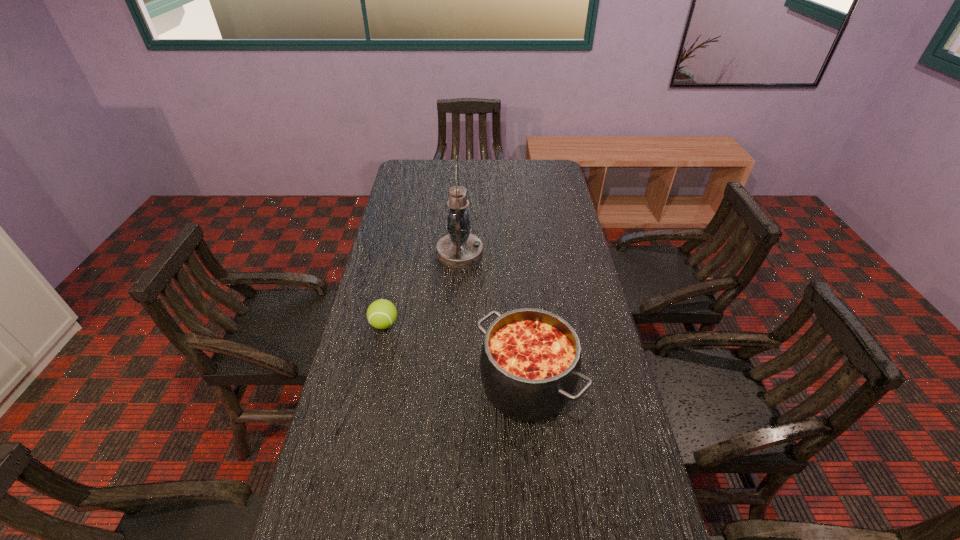
The image size is (960, 540). Identify the location of object present at the right edge. (530, 361).

This screenshot has height=540, width=960. Identify the location of vacant space at the far edge of the desktop. (479, 170).

Find the location of `free location at the left edge of the desktop`. free location at the left edge of the desktop is located at coordinates (391, 368).

This screenshot has height=540, width=960. Find the location of `vacant area at the right edge of the desktop`. vacant area at the right edge of the desktop is located at coordinates (565, 271).

The height and width of the screenshot is (540, 960). Find the location of `free space at the far right corner`. free space at the far right corner is located at coordinates (551, 168).

The width and height of the screenshot is (960, 540). What are the coordinates of `blank region between the leftmost object and the oil lamp` in the screenshot? It's located at (422, 288).

This screenshot has width=960, height=540. In order to click on vacant point located between the tennis ball and the oil lamp in this screenshot , I will do `click(422, 288)`.

Where is `vacant point located between the farthest object and the leftmost object`? The height and width of the screenshot is (540, 960). vacant point located between the farthest object and the leftmost object is located at coordinates pyautogui.click(x=422, y=288).

Locate an element on the screen. This screenshot has width=960, height=540. vacant area between the oil lamp and the casserole is located at coordinates coord(493,319).

Locate an element on the screen. vacant point located between the tennis ball and the second shortest object is located at coordinates 456,354.